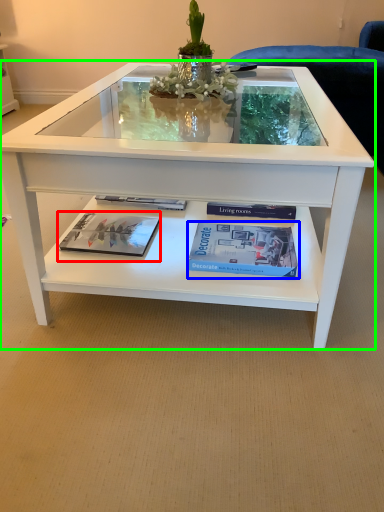
Question: Considering the real-world distances, which object is farthest from magazine (highlighted by a red box)? paperback book (highlighted by a blue box) or coffee table (highlighted by a green box)?

Choices:
 (A) paperback book
 (B) coffee table

Answer: (B)